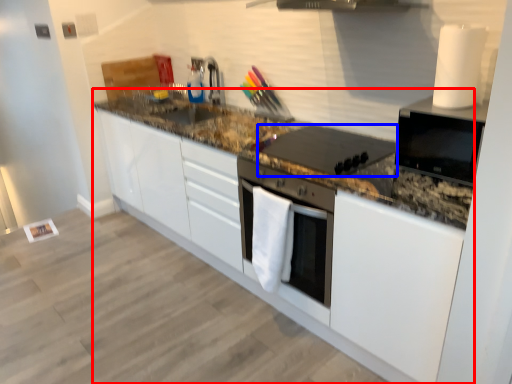
Question: Which point is further to the camera, countertop (highlighted by a red box) or kitchen appliance (highlighted by a blue box)?

Choices:
 (A) countertop
 (B) kitchen appliance

Answer: (B)